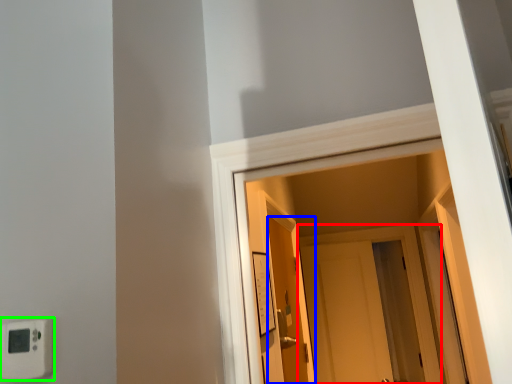
Question: Which object is the farthest from door (highlighted by a red box)? Choose among these: door (highlighted by a blue box) or light switch (highlighted by a green box).

Choices:
 (A) door
 (B) light switch

Answer: (B)